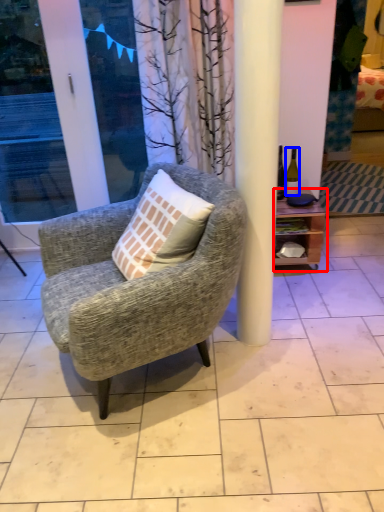
Question: Which point is further to the camera, shelf (highlighted by a red box) or bottle (highlighted by a blue box)?

Choices:
 (A) shelf
 (B) bottle

Answer: (B)